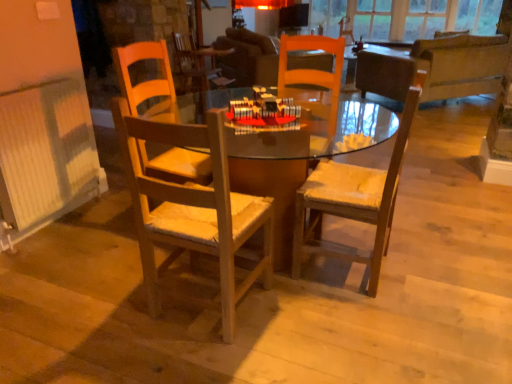
I want to click on empty space that is in between wooden chair with cushion at center, which is counted as the second chair, starting from the left, and wooden table at center, so click(372, 293).